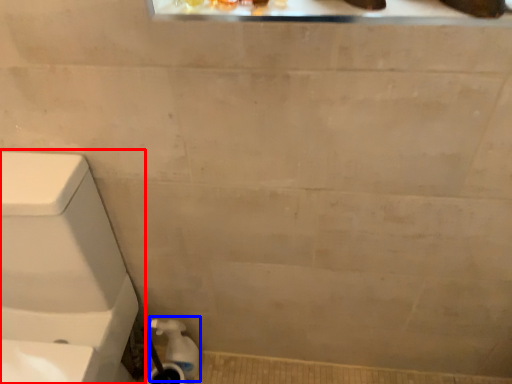
Question: Which object is closer to the camera taking this photo, toilet (highlighted by a red box) or water pipe (highlighted by a blue box)?

Choices:
 (A) toilet
 (B) water pipe

Answer: (A)